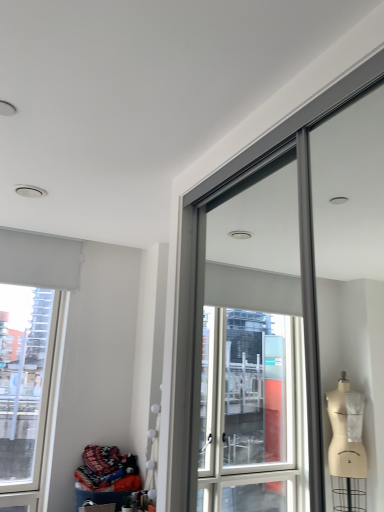
Question: From their relative heights in the image, would you say knitted fabric at lower left is taller or shorter than white matte window at upper left?

Choices:
 (A) tall
 (B) short

Answer: (B)

Question: Is knitted fabric at lower left in front of or behind white matte window at upper left in the image?

Choices:
 (A) behind
 (B) front

Answer: (B)

Question: Is knitted fabric at lower left wider or thinner than white matte window at upper left?

Choices:
 (A) wide
 (B) thin

Answer: (A)

Question: Looking at the image, does white matte window at upper left seem bigger or smaller compared to knitted fabric at lower left?

Choices:
 (A) big
 (B) small

Answer: (A)

Question: Relative to knitted fabric at lower left, is white matte window at upper left in front or behind?

Choices:
 (A) behind
 (B) front

Answer: (A)

Question: Is point (8, 460) positioned closer to the camera than point (99, 474)?

Choices:
 (A) closer
 (B) farther

Answer: (B)

Question: Is white matte window at upper left taller or shorter than knitted fabric at lower left?

Choices:
 (A) tall
 (B) short

Answer: (A)